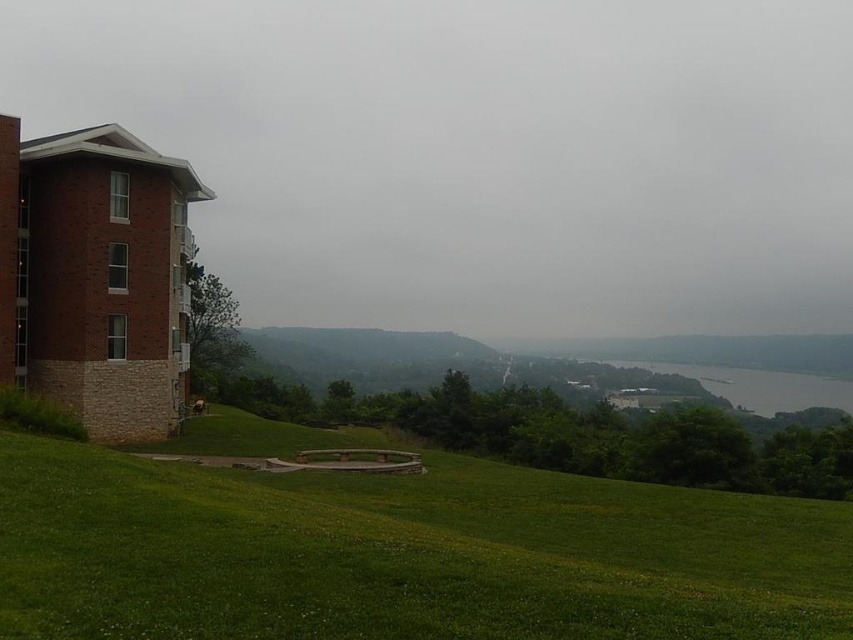
Between point (285, 547) and point (822, 396), which one is positioned in front?

Point (285, 547)

Is point (701, 550) more distant than point (786, 385)?

No, it is not.

At what (x,y) coordinates should I click in order to perform the action: click on green grassy at lower center. Please return your answer as a coordinate pair (x, y). Looking at the image, I should click on (402, 554).